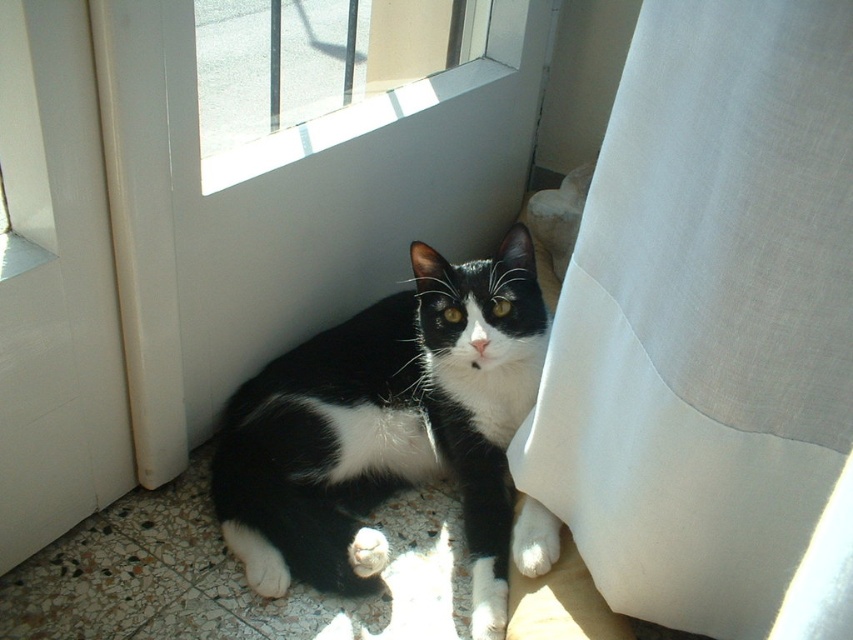
Based on the photo, does black and white fur cat at center appear under white plastic screen door at lower left?

Indeed, black and white fur cat at center is positioned under white plastic screen door at lower left.

You are a GUI agent. You are given a task and a screenshot of the screen. Output one action in this format:
    pyautogui.click(x=<x>, y=<y>)
    Task: Click on the black and white fur cat at center
    Image resolution: width=853 pixels, height=640 pixels.
    Given the screenshot: What is the action you would take?
    (x=392, y=433)

At what (x,y) coordinates should I click in order to perform the action: click on black and white fur cat at center. Please return your answer as a coordinate pair (x, y). Looking at the image, I should click on tap(392, 433).

Is black and white fur cat at center to the right of white glass window at upper center from the viewer's perspective?

Correct, you'll find black and white fur cat at center to the right of white glass window at upper center.

What do you see at coordinates (392, 433) in the screenshot? This screenshot has width=853, height=640. I see `black and white fur cat at center` at bounding box center [392, 433].

Does point (227, 508) come closer to viewer compared to point (434, 88)?

Yes, it is in front of point (434, 88).

At what (x,y) coordinates should I click in order to perform the action: click on black and white fur cat at center. Please return your answer as a coordinate pair (x, y). Looking at the image, I should click on (392, 433).

Who is taller, white plastic screen door at upper center or black and white fur cat at center?

white plastic screen door at upper center is taller.

Does point (149, 465) lie behind point (520, 305)?

Yes, point (149, 465) is farther from viewer.

The width and height of the screenshot is (853, 640). I want to click on white plastic screen door at upper center, so click(x=285, y=205).